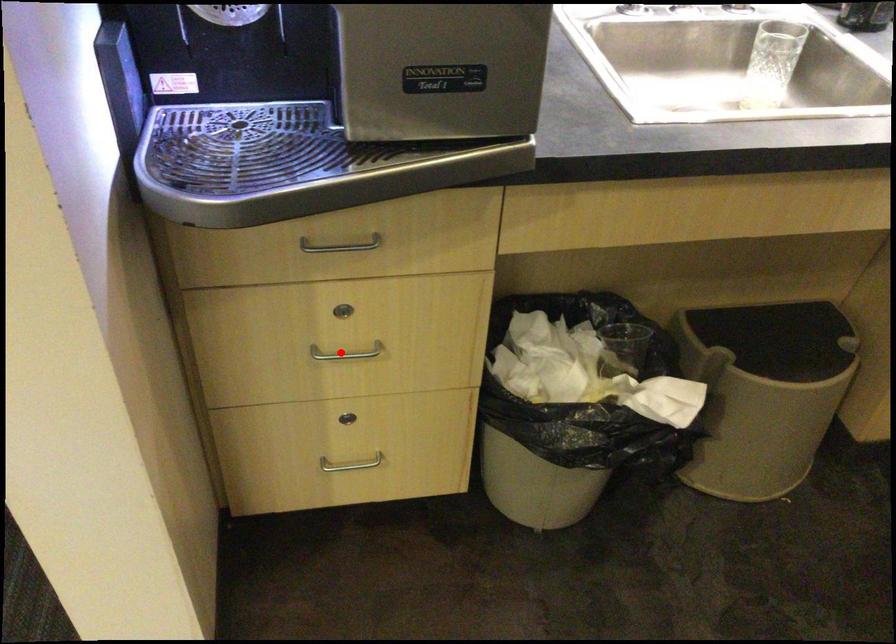
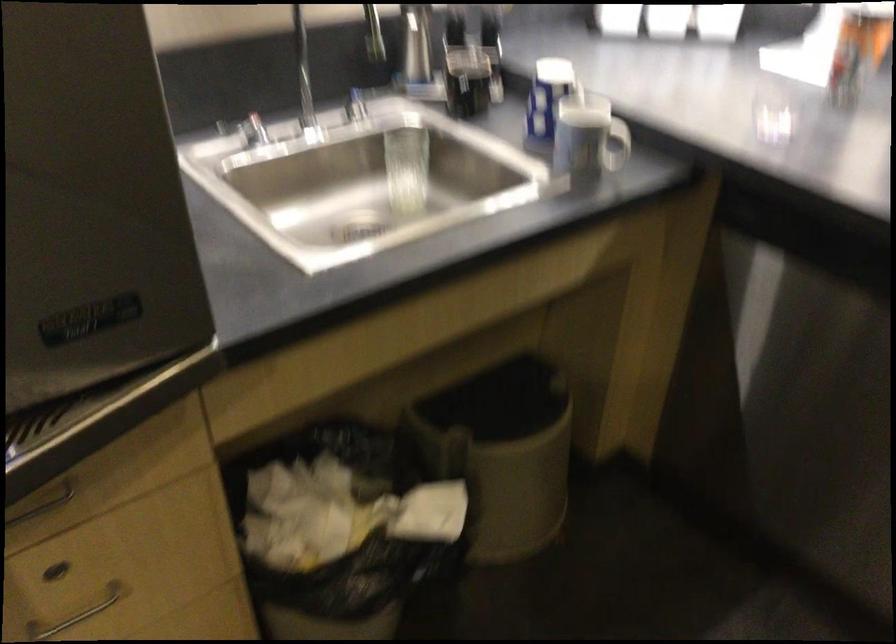
Find the pixel in the second image that matches the highlighted location in the first image.

(76, 614)